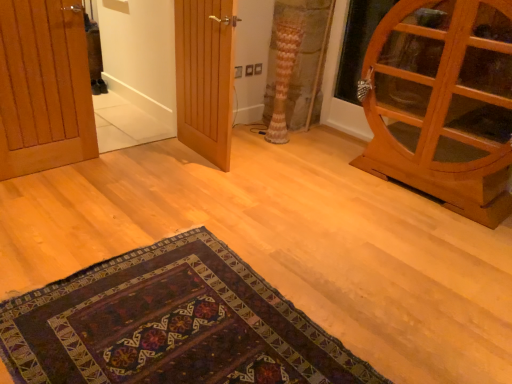
The width and height of the screenshot is (512, 384). Find the location of `vacant space situated on the left part of wooden door at center, the 2th door when ordered from left to right`. vacant space situated on the left part of wooden door at center, the 2th door when ordered from left to right is located at coordinates (145, 159).